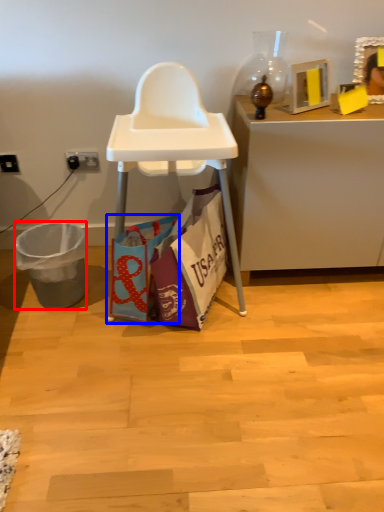
Question: Which point is closer to the camera, trash bin/can (highlighted by a red box) or handbag (highlighted by a blue box)?

Choices:
 (A) trash bin/can
 (B) handbag

Answer: (B)